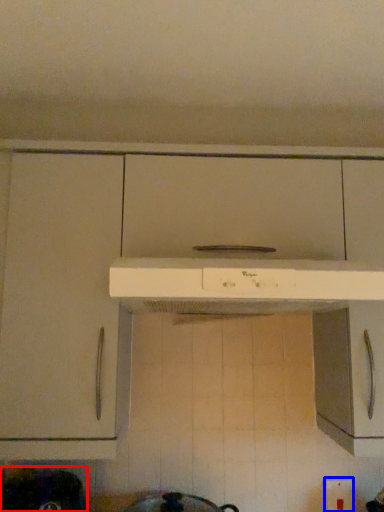
Question: Which point is further to the camera, appliance (highlighted by a red box) or electric outlet (highlighted by a blue box)?

Choices:
 (A) appliance
 (B) electric outlet

Answer: (B)